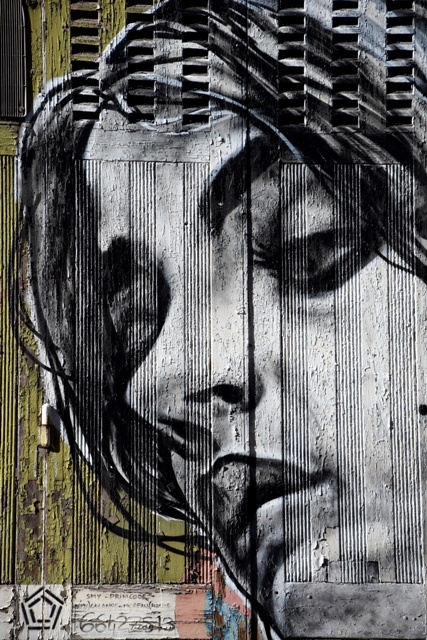
Identify the location of green wall. This screenshot has height=640, width=427. (9, 385).